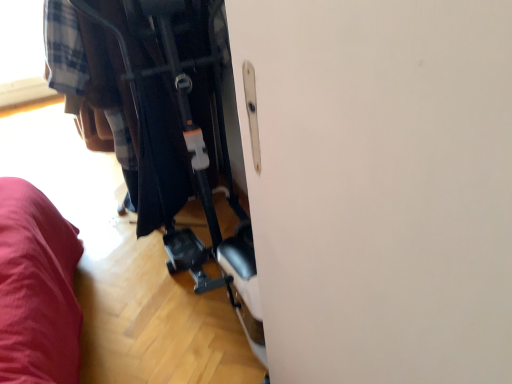
Question: Considering the positions of plaid fabric at center and metallic black baby carriage at center in the image, is plaid fabric at center bigger or smaller than metallic black baby carriage at center?

Choices:
 (A) small
 (B) big

Answer: (A)

Question: Looking at their shapes, would you say plaid fabric at center is wider or thinner than metallic black baby carriage at center?

Choices:
 (A) thin
 (B) wide

Answer: (A)

Question: Is plaid fabric at center situated inside metallic black baby carriage at center or outside?

Choices:
 (A) outside
 (B) inside

Answer: (A)

Question: Looking at their shapes, would you say metallic black baby carriage at center is wider or thinner than plaid fabric at center?

Choices:
 (A) wide
 (B) thin

Answer: (A)

Question: Choose the correct answer: Is metallic black baby carriage at center inside plaid fabric at center or outside it?

Choices:
 (A) inside
 (B) outside

Answer: (B)

Question: In the image, is metallic black baby carriage at center positioned in front of or behind plaid fabric at center?

Choices:
 (A) front
 (B) behind

Answer: (A)

Question: From a real-world perspective, is metallic black baby carriage at center positioned above or below plaid fabric at center?

Choices:
 (A) above
 (B) below

Answer: (A)